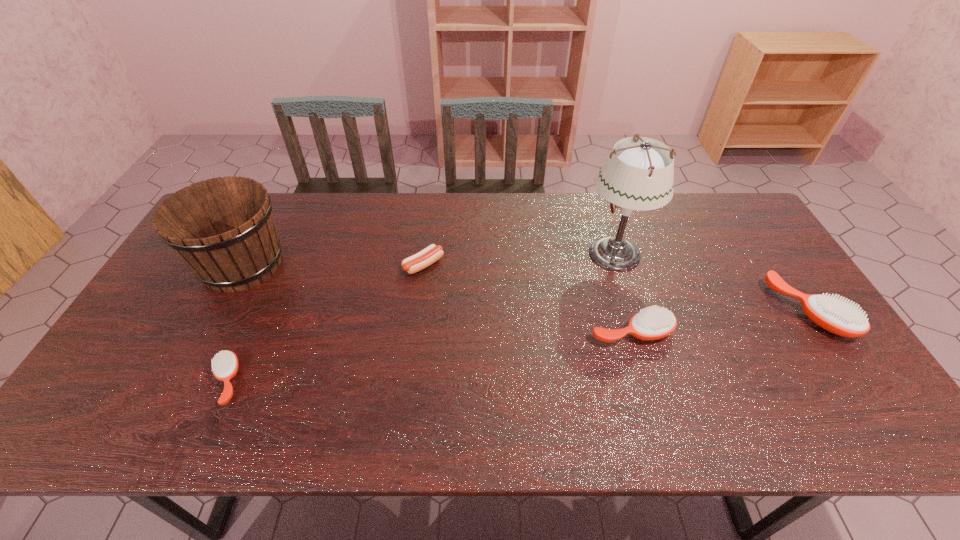
Where is `object at the right edge`? object at the right edge is located at coordinates click(x=837, y=316).

Image resolution: width=960 pixels, height=540 pixels. I want to click on object located in the far left corner section of the desktop, so pos(223,228).

The image size is (960, 540). In the image, there is a desktop. In order to click on vacant space at the far edge in this screenshot , I will do `click(608, 219)`.

In the image, there is a desktop. Where is `vacant region at the near edge`? vacant region at the near edge is located at coordinates (475, 383).

Identify the location of vacant area at the left edge. The image size is (960, 540). (188, 272).

Identify the location of blank space at the right edge of the desktop. (758, 251).

Identify the location of free space between the fifth shortest object and the sausage. (333, 265).

Locate an element on the screen. This screenshot has width=960, height=540. free spot between the nearest object and the rightmost hairbrush is located at coordinates tap(517, 346).

Locate an element on the screen. vacant point located between the second tallest object and the leftmost hairbrush is located at coordinates (234, 323).

This screenshot has height=540, width=960. Find the location of `empty space that is in between the tallest object and the sausage`. empty space that is in between the tallest object and the sausage is located at coordinates coord(519,259).